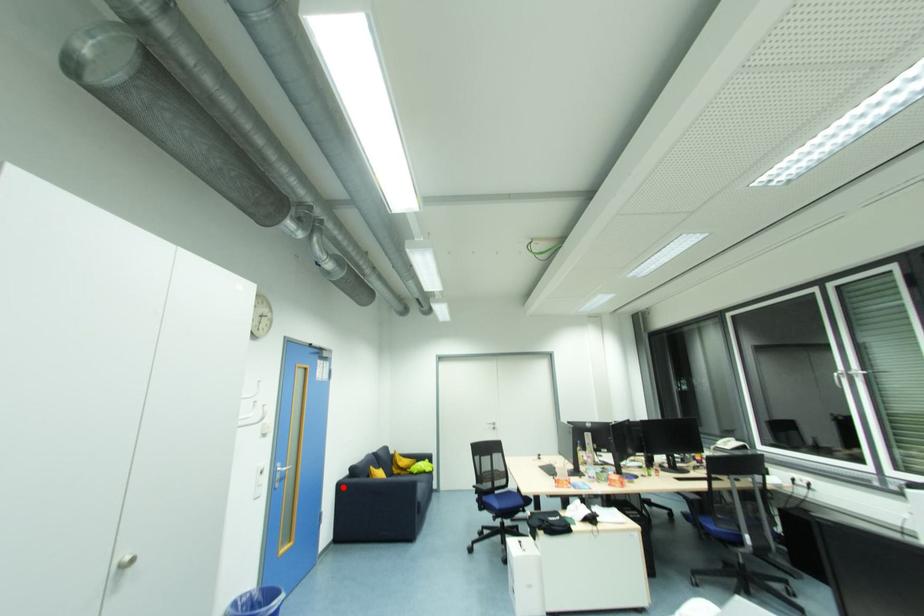
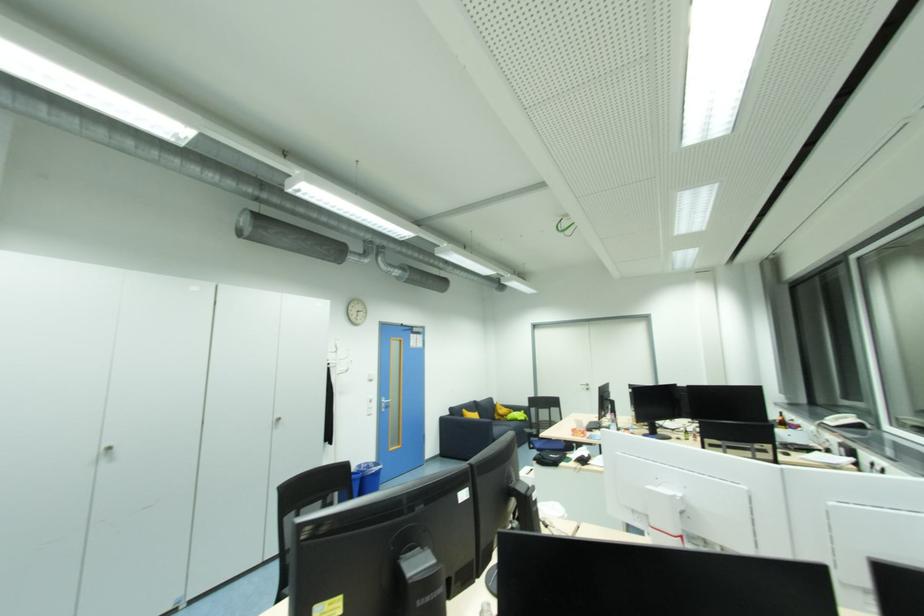
The point at the highlighted location is marked in the first image. Where is the corresponding point in the second image?

(445, 421)